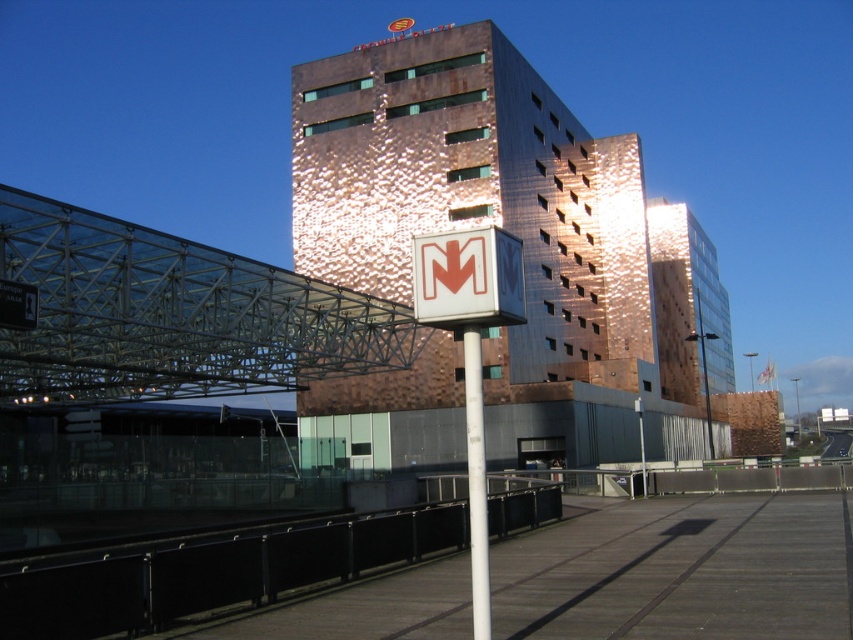
You are a pedestrian standing at the entrance of the metro station. You want to read the white plastic sign at center but the copper hammered metal building at center is blocking your view. Is the sign visible to you?

The white plastic sign at center is behind the copper hammered metal building at center, so it is blocked from view and not visible.

You are a city planner assessing the urban space. The copper hammered metal building at center and the white plastic sign at center are both in your view. Which object occupies more horizontal space in the scene?

The copper hammered metal building at center has a larger width than the white plastic sign at center, so it occupies more horizontal space in the scene.